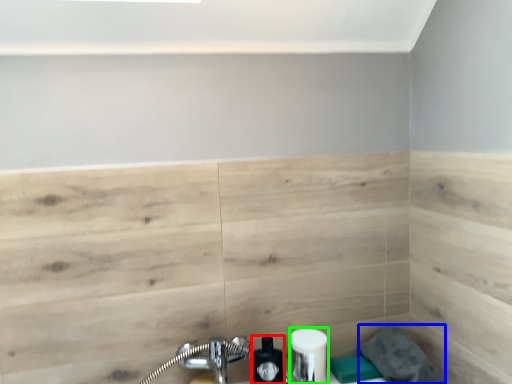
Question: Which is nearer to the soap dispenser (highlighted by a red box)? gray (highlighted by a blue box) or toiletry (highlighted by a green box).

Choices:
 (A) gray
 (B) toiletry

Answer: (B)